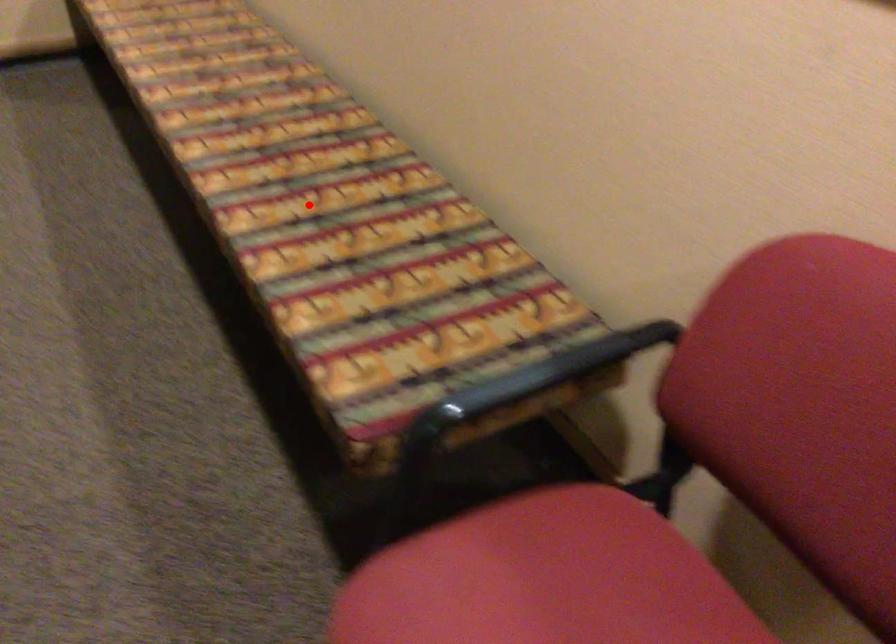
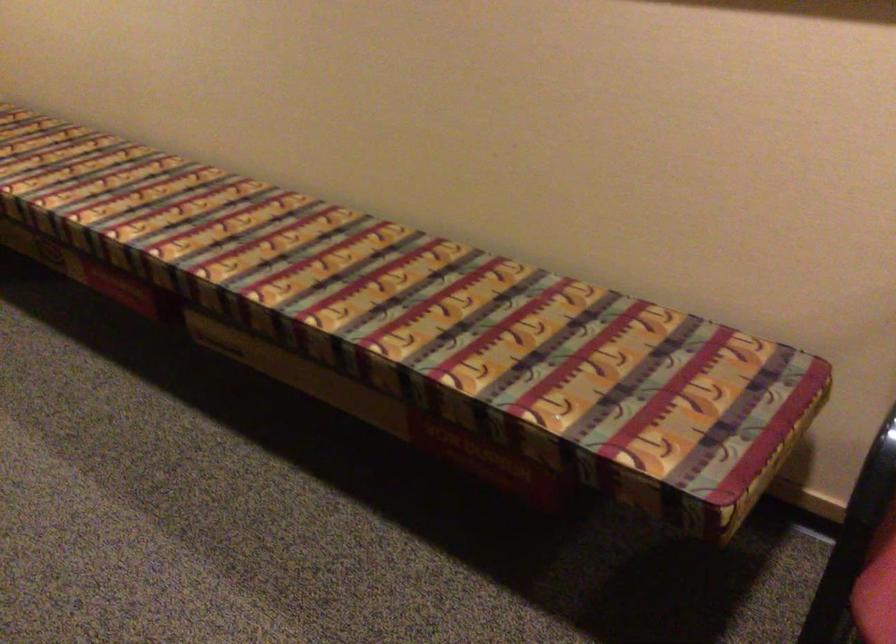
Find the pixel in the second image that matches the highlighted location in the first image.

(426, 315)